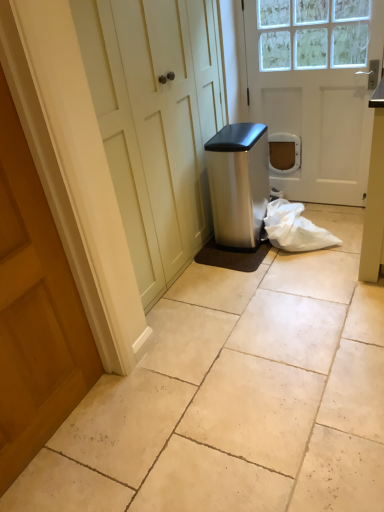
At what (x,y) coordinates should I click in order to perform the action: click on free space underneath satin silver trash can at center (from a real-world perspective). Please return your answer as a coordinate pair (x, y). Looking at the image, I should click on (229, 245).